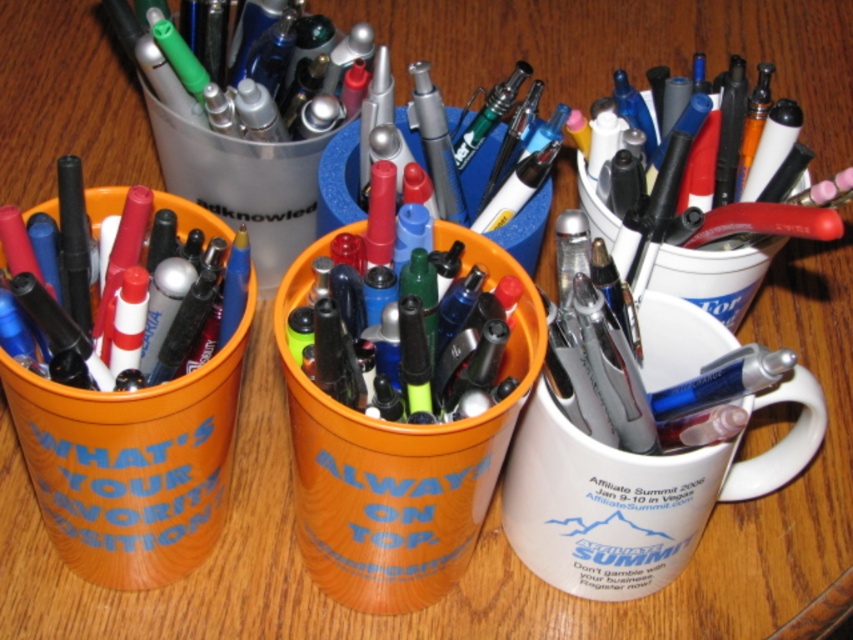
Who is more forward, [756,472] or [438,195]?

Point [438,195] is in front.

Is white ceramic mug at right further to the viewer compared to metallic silver pen at center?

No, white ceramic mug at right is in front of metallic silver pen at center.

Identify the location of white ceramic mug at right. The height and width of the screenshot is (640, 853). (633, 496).

Where is `white ceramic mug at right`? white ceramic mug at right is located at coordinates (633, 496).

From the picture: Does white ceramic mug at right appear on the right side of white matte mug at right?

No, white ceramic mug at right is not to the right of white matte mug at right.

Is white ceramic mug at right further to camera compared to white matte mug at right?

That is False.

Measure the distance between white ceramic mug at right and camera.

They are 26.40 inches apart.

Where is `white ceramic mug at right`? white ceramic mug at right is located at coordinates (633, 496).

Is matte plastic cup at left above metallic silver pen at center?

No.

Is matte plastic cup at left smaller than metallic silver pen at center?

Incorrect, matte plastic cup at left is not smaller in size than metallic silver pen at center.

Which is in front, point (78, 244) or point (439, 179)?

Point (78, 244) is more forward.

Where is `matte plastic cup at left`? The height and width of the screenshot is (640, 853). matte plastic cup at left is located at coordinates (62, 275).